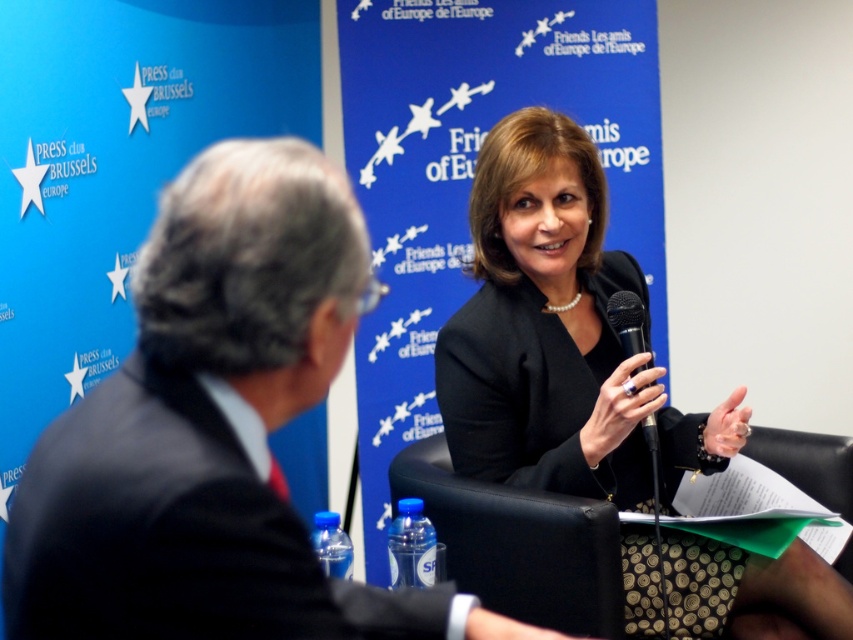
Question: Can you confirm if dark blue fabric suit at right is wider than black metallic microphone at center?

Choices:
 (A) yes
 (B) no

Answer: (A)

Question: Is black glossy suit at center to the right of dark blue fabric suit at right from the viewer's perspective?

Choices:
 (A) yes
 (B) no

Answer: (A)

Question: Considering the real-world distances, which object is farthest from the dark suit at center?

Choices:
 (A) black glossy suit at center
 (B) dark blue fabric suit at right
 (C) black metallic microphone at center

Answer: (C)

Question: Which point is farther from the camera taking this photo?

Choices:
 (A) (239, 346)
 (B) (361, 611)

Answer: (B)

Question: Is dark suit at center wider than dark blue fabric suit at right?

Choices:
 (A) no
 (B) yes

Answer: (B)

Question: Among these points, which one is nearest to the camera?

Choices:
 (A) (628, 340)
 (B) (222, 632)
 (C) (497, 460)
 (D) (258, 493)

Answer: (B)